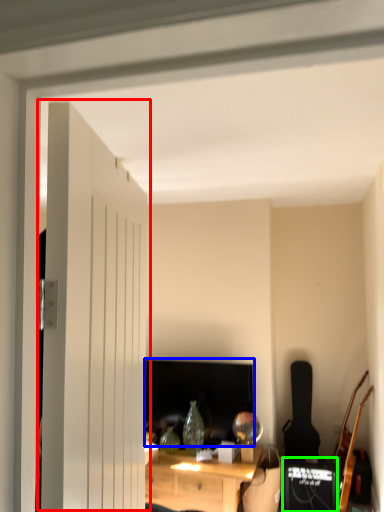
Question: Considering the real-world distances, which object is farthest from door (highlighted by a red box)? computer monitor (highlighted by a blue box) or speaker (highlighted by a green box)?

Choices:
 (A) computer monitor
 (B) speaker

Answer: (B)